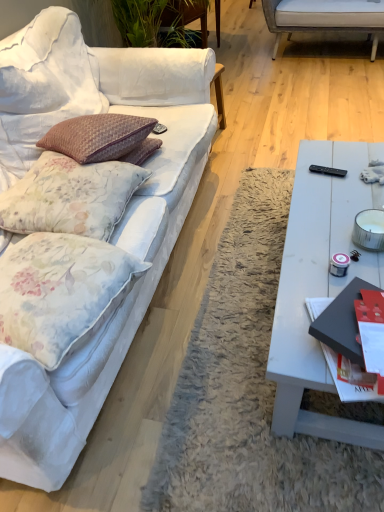
Question: Is black plastic remote control at right next to white fabric couch at left and touching it?

Choices:
 (A) no
 (B) yes

Answer: (A)

Question: Does black plastic remote control at right appear on the left side of white fabric couch at left?

Choices:
 (A) yes
 (B) no

Answer: (B)

Question: From a real-world perspective, does black plastic remote control at right stand above white fabric couch at left?

Choices:
 (A) no
 (B) yes

Answer: (A)

Question: Does black plastic remote control at right have a greater width compared to white fabric couch at left?

Choices:
 (A) yes
 (B) no

Answer: (B)

Question: Is black plastic remote control at right closer to camera compared to white fabric couch at left?

Choices:
 (A) yes
 (B) no

Answer: (B)

Question: Considering the relative positions of red glossy magazine at right and black plastic remote control at right in the image provided, is red glossy magazine at right to the left or to the right of black plastic remote control at right?

Choices:
 (A) right
 (B) left

Answer: (B)

Question: From a real-world perspective, relative to black plastic remote control at right, is red glossy magazine at right vertically above or below?

Choices:
 (A) above
 (B) below

Answer: (A)

Question: In terms of height, does red glossy magazine at right look taller or shorter compared to black plastic remote control at right?

Choices:
 (A) short
 (B) tall

Answer: (B)

Question: In the image, is red glossy magazine at right positioned in front of or behind black plastic remote control at right?

Choices:
 (A) behind
 (B) front

Answer: (B)

Question: Is red glossy magazine at right spatially inside white fabric couch at left, or outside of it?

Choices:
 (A) inside
 (B) outside

Answer: (B)

Question: From a real-world perspective, is red glossy magazine at right physically located above or below white fabric couch at left?

Choices:
 (A) above
 (B) below

Answer: (A)

Question: Would you say red glossy magazine at right is to the left or to the right of white fabric couch at left in the picture?

Choices:
 (A) right
 (B) left

Answer: (A)

Question: Considering the positions of red glossy magazine at right and white fabric couch at left in the image, is red glossy magazine at right taller or shorter than white fabric couch at left?

Choices:
 (A) short
 (B) tall

Answer: (A)

Question: Is floral fabric pillow at left, which ranks as the 2th pillow in bottom-to-top order, bigger or smaller than white matte coffee table at right?

Choices:
 (A) big
 (B) small

Answer: (B)

Question: Relative to white matte coffee table at right, is floral fabric pillow at left, acting as the first pillow starting from the top, in front or behind?

Choices:
 (A) behind
 (B) front

Answer: (A)